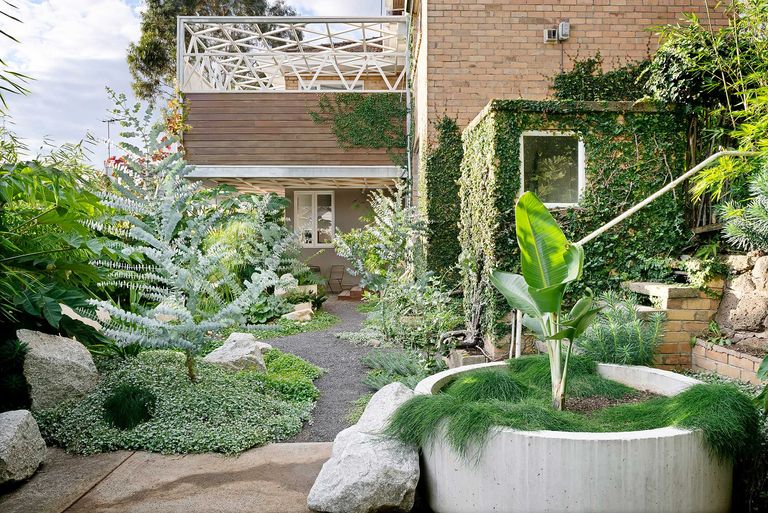
At what (x,y) coordinates should I click in order to perform the action: click on plant. Please return your answer as a coordinate pair (x, y). Looking at the image, I should click on (551, 297), (269, 310), (174, 301), (667, 262), (630, 342), (408, 303), (378, 256), (269, 269), (32, 289).